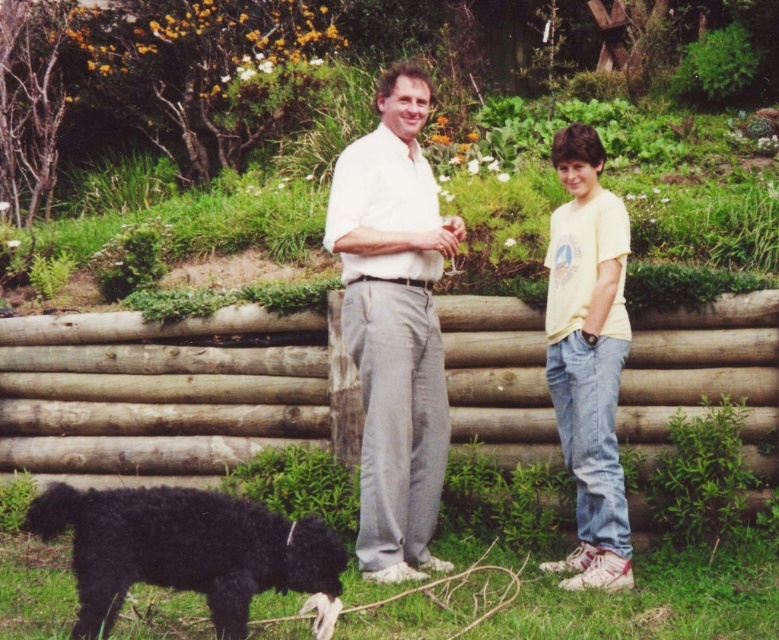
Between white cotton shirt at center and yellow cotton shirt at right, which one is positioned higher?

Positioned higher is white cotton shirt at center.

Between white cotton shirt at center and yellow cotton shirt at right, which one has less height?

yellow cotton shirt at right is shorter.

Who is more forward, (x=365, y=413) or (x=598, y=372)?

Point (x=598, y=372) is in front.

Where is `white cotton shirt at center`? This screenshot has height=640, width=779. white cotton shirt at center is located at coordinates (393, 324).

Does black fuzzy dog at lower left appear on the left side of yellow cotton shirt at right?

Indeed, black fuzzy dog at lower left is positioned on the left side of yellow cotton shirt at right.

You are a GUI agent. You are given a task and a screenshot of the screen. Output one action in this format:
    pyautogui.click(x=<x>, y=<y>)
    Task: Click on the black fuzzy dog at lower left
    The image size is (779, 640).
    Given the screenshot: What is the action you would take?
    pyautogui.click(x=182, y=548)

Is point (383, 528) positioned behind point (294, 568)?

That is True.

Which is in front, point (365, 240) or point (110, 620)?

Point (110, 620) is in front.

You are a GUI agent. You are given a task and a screenshot of the screen. Output one action in this format:
    pyautogui.click(x=<x>, y=<y>)
    Task: Click on the white cotton shirt at center
    The height and width of the screenshot is (640, 779).
    Given the screenshot: What is the action you would take?
    pyautogui.click(x=393, y=324)